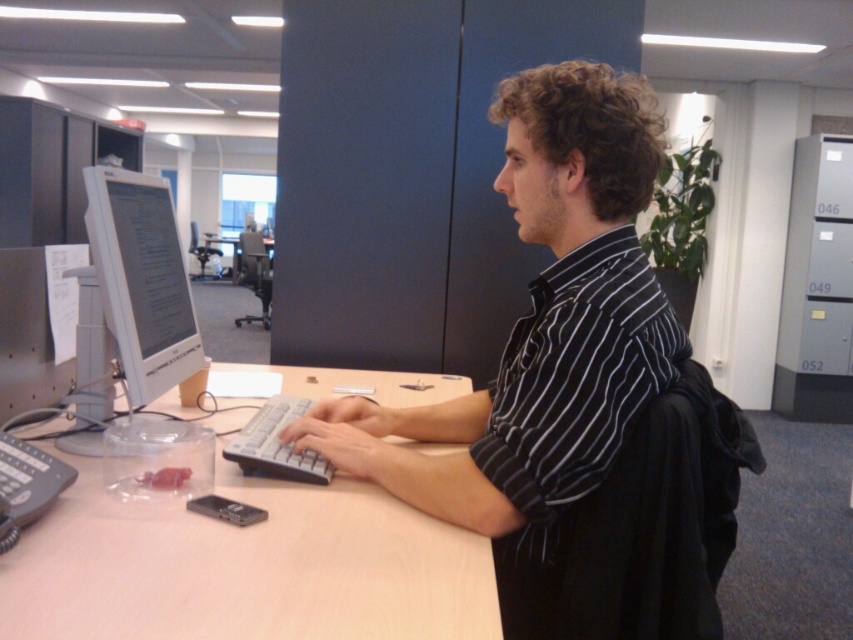
You are organizing the desk and need to place a new item. Considering the white plastic keyboard at center and the wooden desk at center, which object is smaller in size?

The white plastic keyboard at center is smaller in size compared to the wooden desk at center.

You are an office assistant who needs to determine if the black striped shirt at center can be placed on the light brown wood computer desk at center. Based on their sizes, is this possible?

The black striped shirt at center is bigger than the light brown wood computer desk at center, so it cannot be placed on the desk due to its larger size.